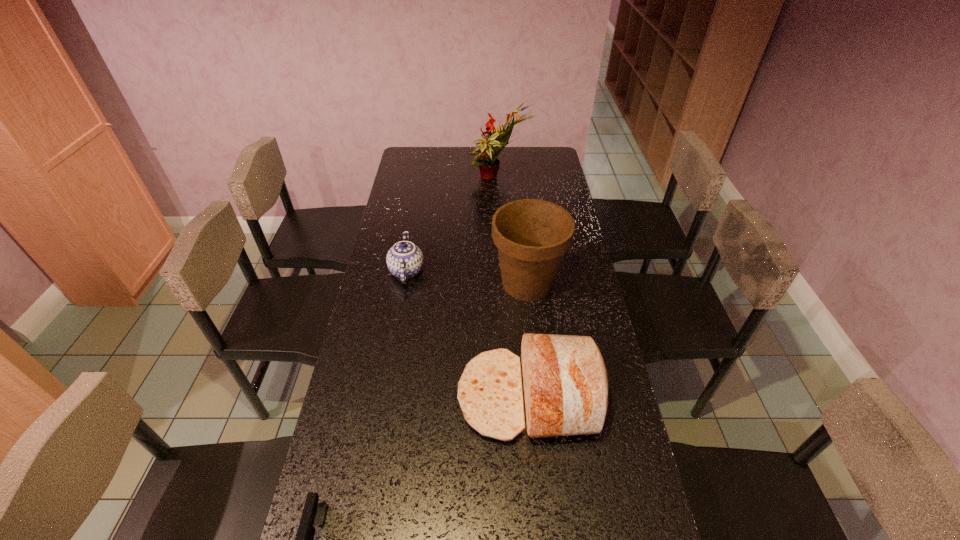
The width and height of the screenshot is (960, 540). What are the coordinates of `free space located 0.180m on the left of the fourth shortest object` in the screenshot? It's located at (439, 284).

Where is `free location located at the sliced end of the bread`? free location located at the sliced end of the bread is located at coordinates (360, 396).

Where is `vacant region located 0.090m at the sliced end of the bread`? The height and width of the screenshot is (540, 960). vacant region located 0.090m at the sliced end of the bread is located at coordinates (425, 396).

Locate an element on the screen. This screenshot has width=960, height=540. blank space located at the sliced end of the bread is located at coordinates (342, 396).

You are a GUI agent. You are given a task and a screenshot of the screen. Output one action in this format:
    pyautogui.click(x=<x>, y=<y>)
    Task: Click on the vacant space located 0.280m at the spout of the second shortest object
    
    Given the screenshot: What is the action you would take?
    pyautogui.click(x=503, y=271)

Where is `object present at the far edge`? object present at the far edge is located at coordinates (486, 159).

The height and width of the screenshot is (540, 960). I want to click on object at the left edge, so click(x=404, y=260).

Where is `bouquet located in the right edge section of the desktop`? Image resolution: width=960 pixels, height=540 pixels. bouquet located in the right edge section of the desktop is located at coordinates point(486,159).

Identify the location of flowerpot at the right edge. (532, 235).

The width and height of the screenshot is (960, 540). I want to click on bread situated at the right edge, so click(565, 383).